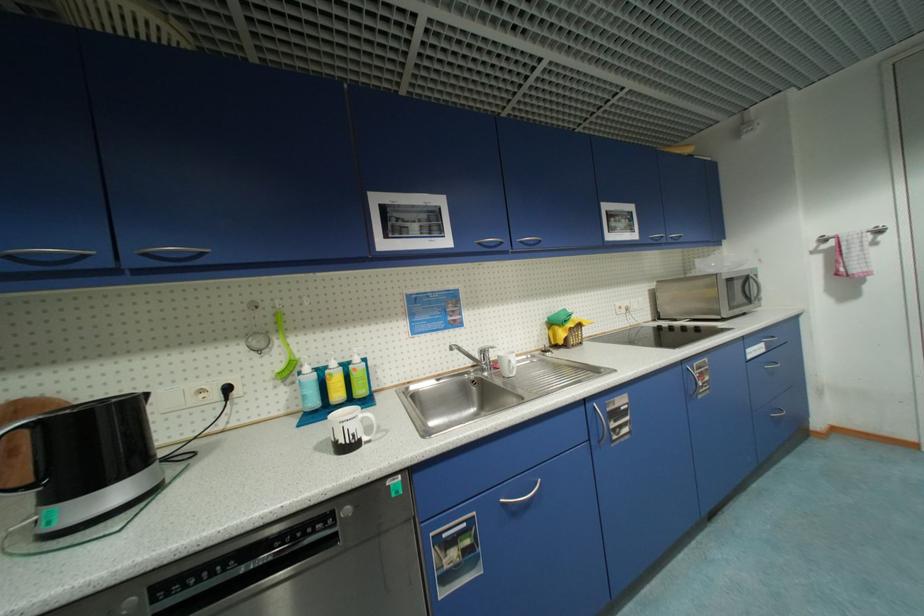
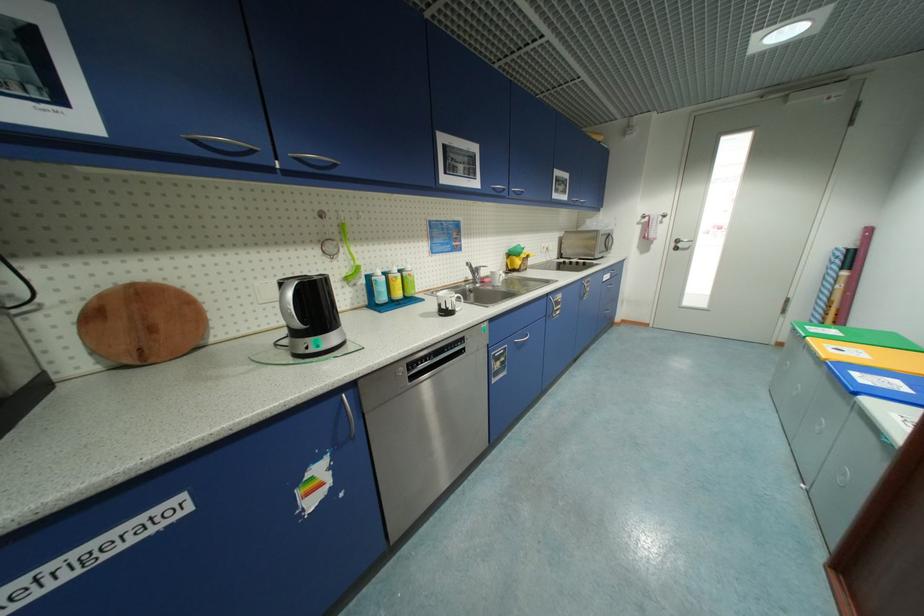
Locate, in the second image, the point that corresponds to [736,281] in the first image.

(609, 236)